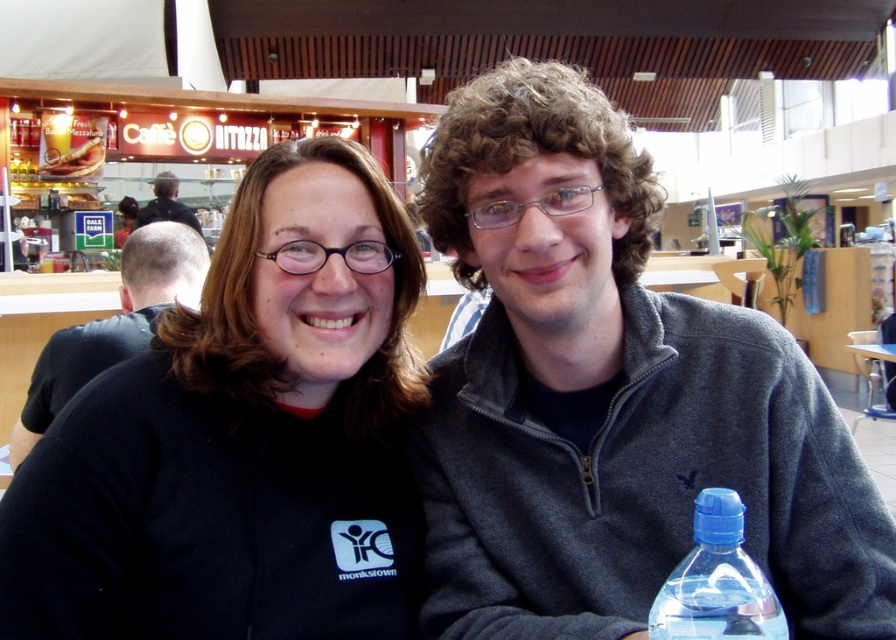
Does black fleece jacket at center have a greater height compared to transparent plastic bottle at lower right?

Indeed, black fleece jacket at center has a greater height compared to transparent plastic bottle at lower right.

Who is more distant from viewer, [282,340] or [679,584]?

Positioned behind is point [282,340].

What are the coordinates of `black fleece jacket at center` in the screenshot? It's located at (242, 436).

In the scene shown: Between dark gray fleece jacket at left and dark brown hair at upper left, which one is positioned lower?

dark gray fleece jacket at left

Looking at this image, which is above, dark gray fleece jacket at left or dark brown hair at upper left?

dark brown hair at upper left

You are a GUI agent. You are given a task and a screenshot of the screen. Output one action in this format:
    pyautogui.click(x=<x>, y=<y>)
    Task: Click on the dark gray fleece jacket at left
    
    Given the screenshot: What is the action you would take?
    pyautogui.click(x=113, y=324)

Does black fleece jacket at center appear over dark gray fleece jacket at left?

No, black fleece jacket at center is not above dark gray fleece jacket at left.

Does black fleece jacket at center appear on the left side of dark gray fleece jacket at left?

No, black fleece jacket at center is not to the left of dark gray fleece jacket at left.

Is point (278, 570) positioned in front of point (153, 225)?

Yes.

Find the location of a particular element. black fleece jacket at center is located at coordinates (242, 436).